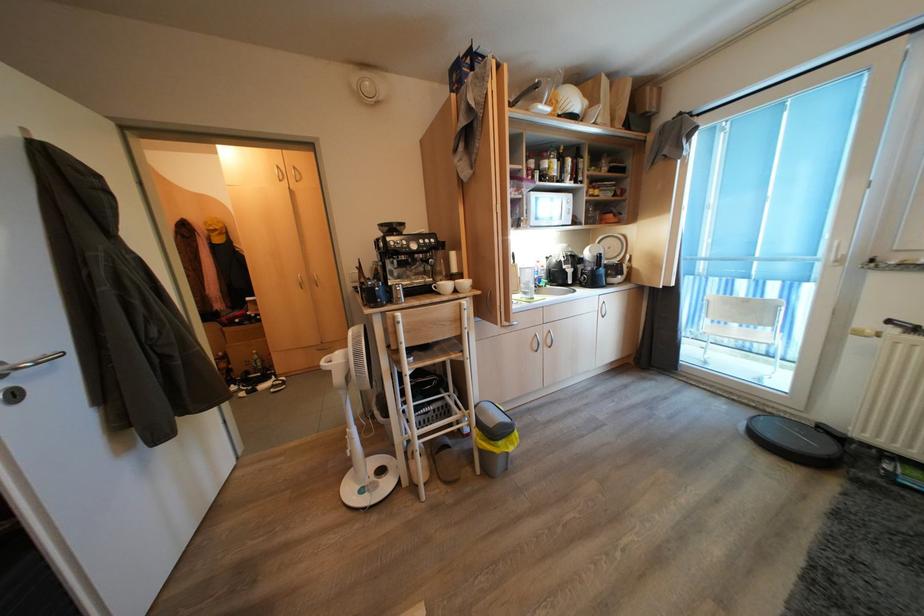
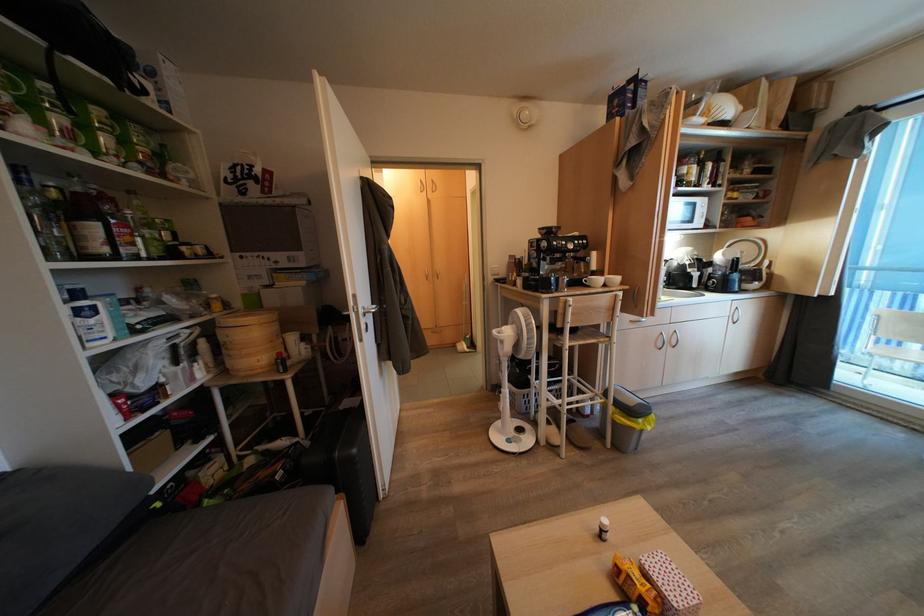
In the second image, find the point that corresponds to pixel 386 248 in the first image.

(549, 248)